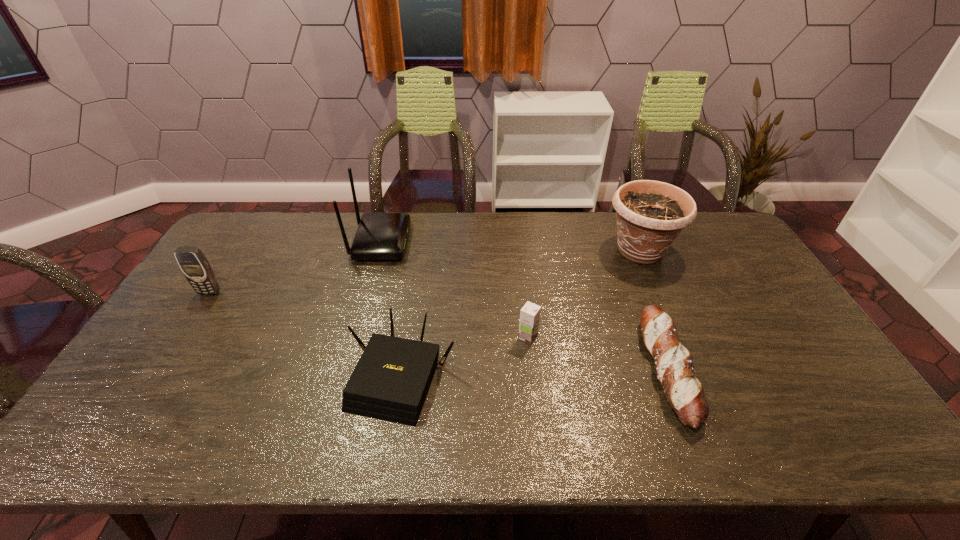
This screenshot has height=540, width=960. I want to click on vacant region located 0.180m on the front of the chocolate milk, so click(x=535, y=403).

What are the coordinates of `vacant region located 0.210m on the left of the nearer router` in the screenshot? It's located at (266, 377).

At what (x,y) coordinates should I click in order to perform the action: click on free space located on the left of the baguet. Please return your answer as a coordinate pair (x, y). The height and width of the screenshot is (540, 960). Looking at the image, I should click on (613, 370).

Find the location of a particular element. router located in the far edge section of the desktop is located at coordinates (380, 236).

Locate an element on the screen. This screenshot has height=540, width=960. flowerpot that is at the far edge is located at coordinates coord(650,214).

What are the coordinates of `router situated at the near edge` in the screenshot? It's located at (390, 382).

Find the location of a particular element. The height and width of the screenshot is (540, 960). baguet that is at the near edge is located at coordinates (673, 362).

Identify the location of object located in the left edge section of the desktop. This screenshot has height=540, width=960. (191, 260).

In the image, there is a desktop. At what (x,y) coordinates should I click in order to perform the action: click on free space at the far edge. Please return your answer as a coordinate pair (x, y). Image resolution: width=960 pixels, height=540 pixels. Looking at the image, I should click on (612, 251).

You are a GUI agent. You are given a task and a screenshot of the screen. Output one action in this format:
    pyautogui.click(x=<x>, y=<y>)
    Task: Click on the vacant space at the near edge of the desktop
    This screenshot has height=540, width=960.
    Given the screenshot: What is the action you would take?
    pyautogui.click(x=708, y=444)